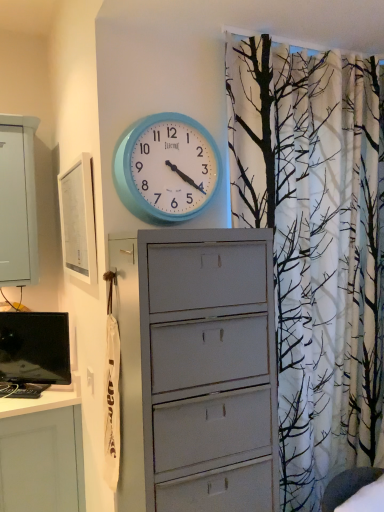
At what (x,y) coordinates should I click in order to perform the action: click on light blue plastic wall clock at upper center. Please return your answer as a coordinate pair (x, y). Looking at the image, I should click on (167, 168).

This screenshot has width=384, height=512. What do you see at coordinates (167, 168) in the screenshot? I see `light blue plastic wall clock at upper center` at bounding box center [167, 168].

Measure the distance between point [197,123] and camera.

Point [197,123] and camera are 1.42 meters apart.

Locate an element on the screen. light blue plastic wall clock at upper center is located at coordinates (167, 168).